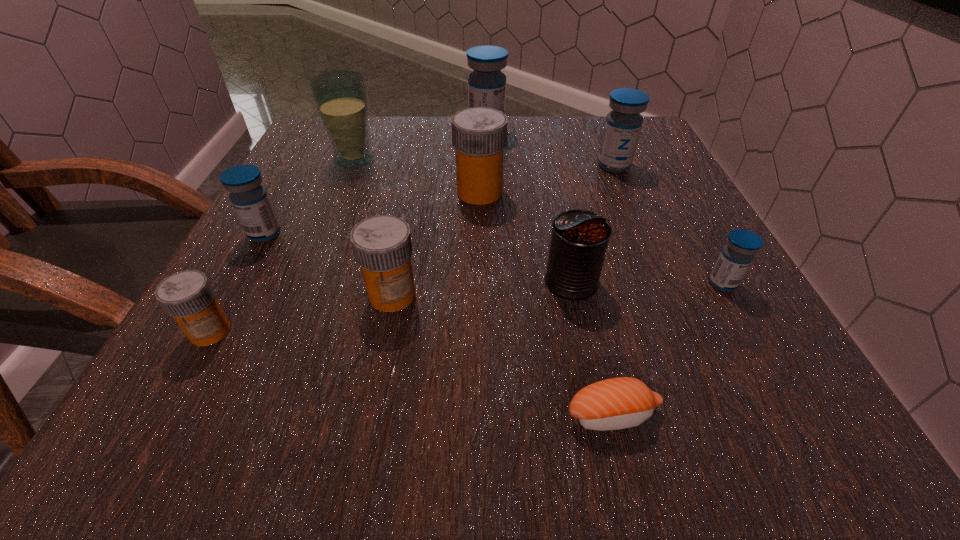
At what (x,y) coordinates should I click in order to perform the action: click on the tallest medicine. Please return your answer as a coordinate pair (x, y). Looking at the image, I should click on (486, 84).

Find the location of a particular element. This screenshot has width=960, height=540. the farthest medicine is located at coordinates (486, 84).

The width and height of the screenshot is (960, 540). Identify the location of the third object from left to right. (340, 96).

Identify the location of blue glass. (340, 96).

Image resolution: width=960 pixels, height=540 pixels. I want to click on the biggest orange medicine, so click(x=479, y=135).

Where is `the fifth nearest medicine`? the fifth nearest medicine is located at coordinates (479, 135).

Image resolution: width=960 pixels, height=540 pixels. Find the location of `the second farthest medicine`. the second farthest medicine is located at coordinates (623, 124).

Identify the location of the third blue medicine from left to right. (623, 124).

The width and height of the screenshot is (960, 540). Find the location of `can`. can is located at coordinates (579, 240).

Locate an element on the screen. Image resolution: width=960 pixels, height=540 pixels. the leftmost blue medicine is located at coordinates (250, 200).